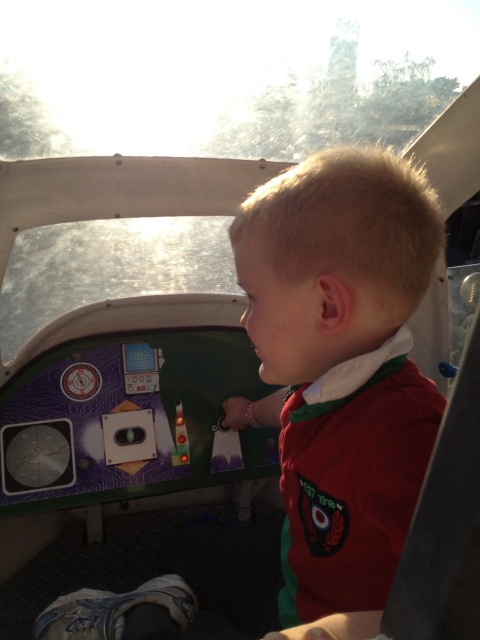
Is point (320, 362) less distant than point (176, 403)?

Yes, it is in front of point (176, 403).

Does point (435, 428) come closer to viewer compared to point (175, 401)?

Yes, point (435, 428) is in front of point (175, 401).

The image size is (480, 640). I want to click on matte red shirt at center, so click(310, 413).